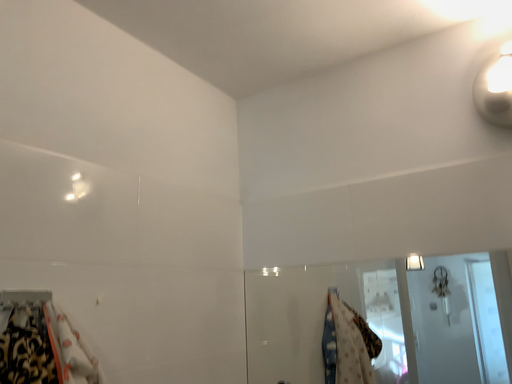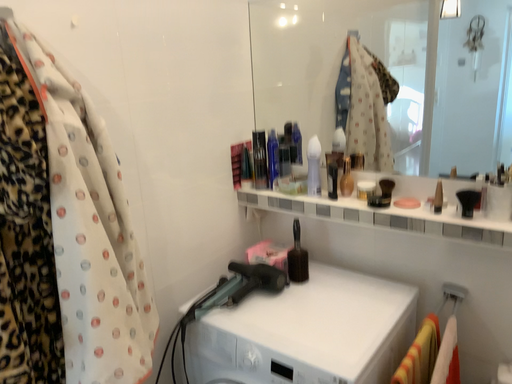
Question: Which way did the camera rotate in the video?

Choices:
 (A) rotated upward
 (B) rotated downward

Answer: (B)